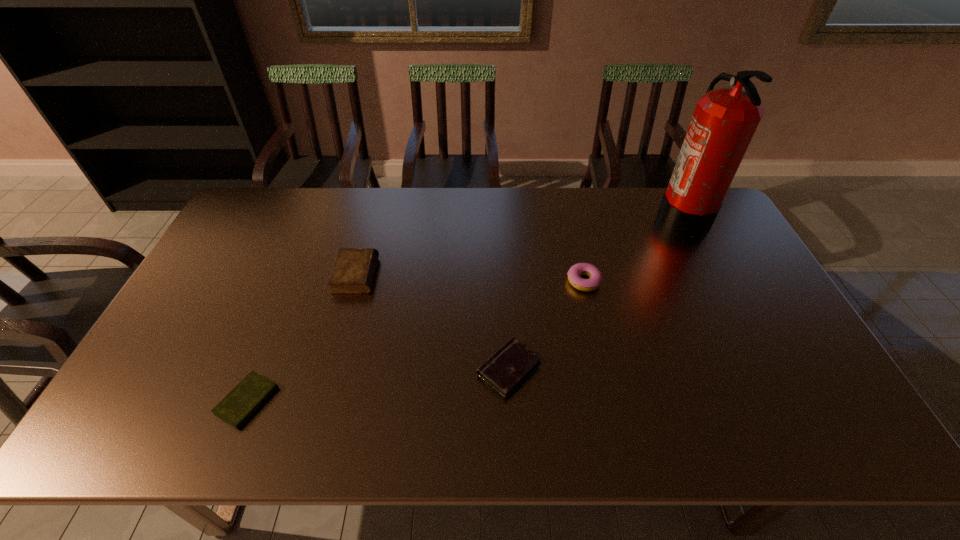
I want to click on vacant area at the far edge of the desktop, so click(x=650, y=226).

Image resolution: width=960 pixels, height=540 pixels. Identify the location of vacant space at the near edge of the desktop. (588, 414).

The height and width of the screenshot is (540, 960). In order to click on free location at the left edge in this screenshot , I will do `click(232, 286)`.

You are a GUI agent. You are given a task and a screenshot of the screen. Output one action in this format:
    pyautogui.click(x=<x>, y=<y>)
    Task: Click on the vacant space at the near left corner
    Image resolution: width=960 pixels, height=540 pixels.
    Given the screenshot: What is the action you would take?
    pyautogui.click(x=111, y=429)

This screenshot has width=960, height=540. In order to click on vacant region at the near right corner of the desktop in this screenshot , I will do `click(840, 432)`.

Identify the location of vacant point located between the fourth object from left to right and the leftmost diary. Image resolution: width=960 pixels, height=540 pixels. (416, 341).

Where is `empty space that is in between the rightmost object and the fourth tallest object`? This screenshot has width=960, height=540. empty space that is in between the rightmost object and the fourth tallest object is located at coordinates (596, 292).

The width and height of the screenshot is (960, 540). What are the coordinates of `free space between the farthest diary and the leftmost diary` in the screenshot? It's located at (301, 338).

You are a GUI agent. You are given a task and a screenshot of the screen. Output one action in this format:
    pyautogui.click(x=<x>, y=<y>)
    Task: Click on the empty space between the fourth tallest object and the fire extinguisher
    
    Given the screenshot: What is the action you would take?
    (x=596, y=292)

Find the location of a particular element. This screenshot has width=960, height=540. vacant area that lies between the farthest object and the second diary from right to left is located at coordinates (519, 245).